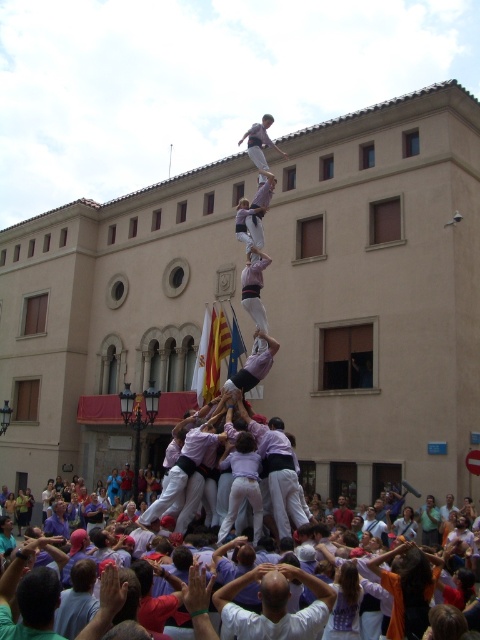
Question: Can you confirm if white cotton shirt at center is bigger than light purple shirt at center?

Choices:
 (A) yes
 (B) no

Answer: (B)

Question: Which object appears farthest from the camera in this image?

Choices:
 (A) white cotton shirt at center
 (B) light purple shirt at center

Answer: (B)

Question: In this image, where is white cotton shirt at center located relative to light purple shirt at center?

Choices:
 (A) above
 (B) below

Answer: (B)

Question: Is white cotton shirt at center closer to the viewer compared to light purple shirt at center?

Choices:
 (A) no
 (B) yes

Answer: (B)

Question: Which point appears closest to the camera in this image?

Choices:
 (A) (327, 600)
 (B) (260, 156)

Answer: (A)

Question: Which point is closer to the camera?

Choices:
 (A) (273, 147)
 (B) (239, 616)

Answer: (B)